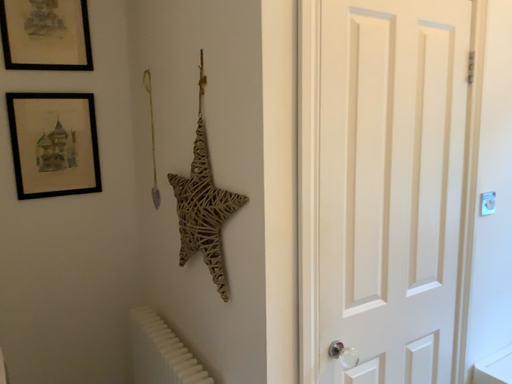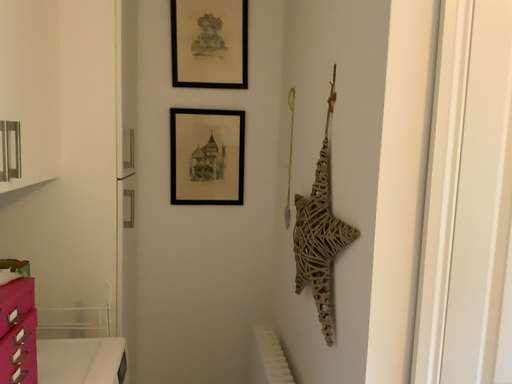
Question: Which way did the camera rotate in the video?

Choices:
 (A) rotated right
 (B) rotated left

Answer: (B)